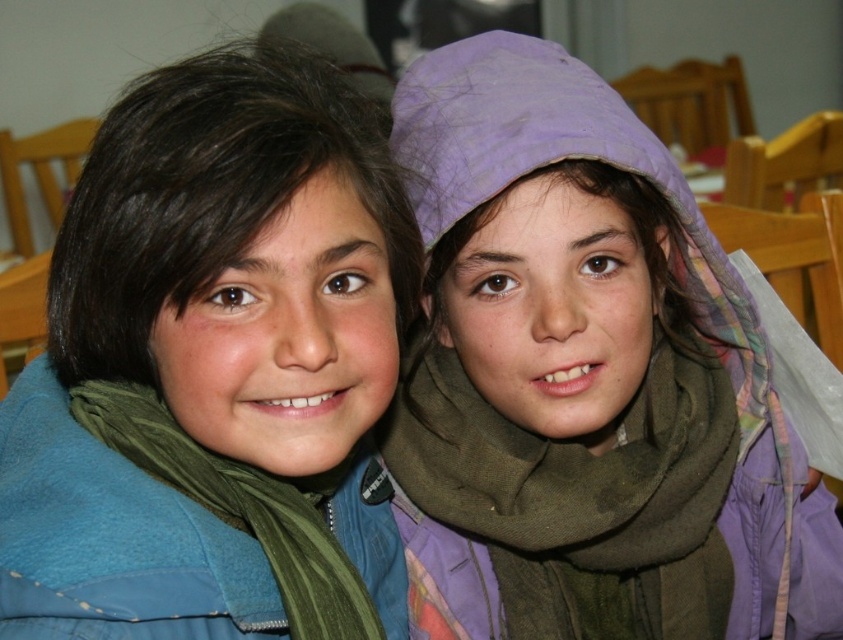
Question: Which object appears closest to the camera in this image?

Choices:
 (A) green fleece jacket at left
 (B) green matte scarf at lower left
 (C) purple fabric headscarf at upper right

Answer: (A)

Question: Estimate the real-world distances between objects in this image. Which object is farther from the green matte scarf at lower left?

Choices:
 (A) green fleece jacket at left
 (B) green fabric scarf at center
 (C) purple fabric headscarf at upper right

Answer: (C)

Question: Is green fleece jacket at left positioned before green fabric scarf at center?

Choices:
 (A) yes
 (B) no

Answer: (A)

Question: Is green fabric scarf at center positioned before green matte scarf at lower left?

Choices:
 (A) yes
 (B) no

Answer: (B)

Question: Which is nearer to the purple fabric headscarf at upper right?

Choices:
 (A) green fleece jacket at left
 (B) green fabric scarf at center

Answer: (B)

Question: In this image, where is green fleece jacket at left located relative to green matte scarf at lower left?

Choices:
 (A) below
 (B) above

Answer: (B)